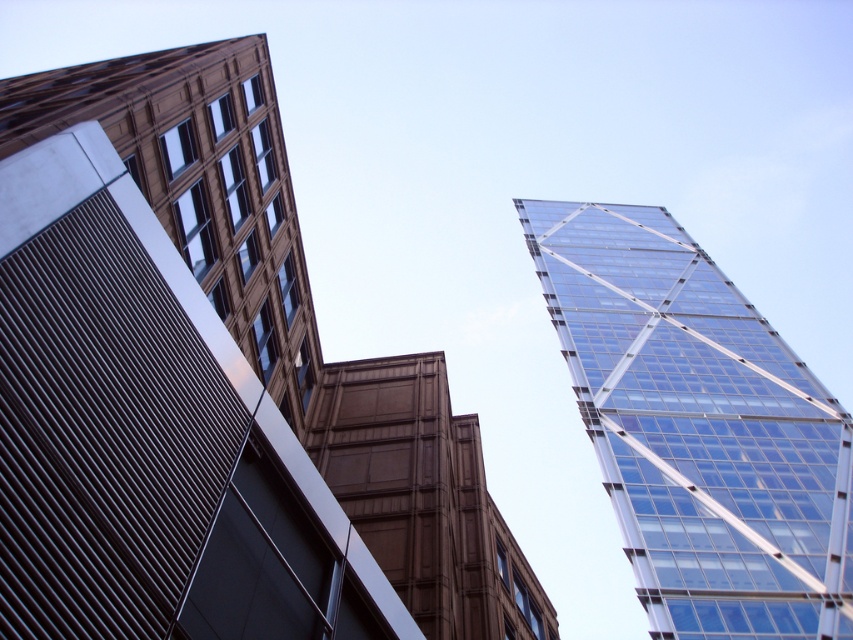
You are an architect evaluating the feasibility of installing solar panels on the transparent glass tower at upper right and the transparent glass skyscraper at upper right. Given their sizes, which building would require more solar panels to cover the same percentage of its facade?

The transparent glass tower at upper right is larger in size than the transparent glass skyscraper at upper right, so it would require more solar panels to cover the same percentage of its facade.